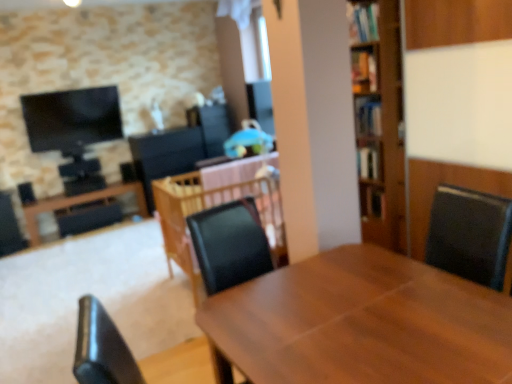
Measure the distance between wooden table at center, the second table in the back-to-front sequence, and camera.

A distance of 6.53 feet exists between wooden table at center, the second table in the back-to-front sequence, and camera.

Locate an element on the screen. wooden table at center, the second table in the back-to-front sequence is located at coordinates (208, 208).

Is the position of wooden table at center, the 2th table in the front-to-back sequence, more distant than that of wooden bookshelf at right, the 1th shelf in the bottom-to-top sequence?

No, it is not.

Between wooden table at center, the second table in the back-to-front sequence, and wooden bookshelf at right, the 1th shelf in the bottom-to-top sequence, which one has larger size?

A: wooden table at center, the second table in the back-to-front sequence, is bigger.

Does wooden table at center, the second table in the back-to-front sequence, have a lesser width compared to wooden bookshelf at right, which is the first shelf from back to front?

No.

Is wooden table at center, the second table in the back-to-front sequence, not near wooden bookshelf at right, which is the first shelf from back to front?

Yes, wooden table at center, the second table in the back-to-front sequence, and wooden bookshelf at right, which is the first shelf from back to front, are located far from each other.

Is wooden bookshelf at upper right, which is the 1th shelf in front-to-back order, positioned far away from wooden table at center, marked as the 3th table in a back-to-front arrangement?

wooden bookshelf at upper right, which is the 1th shelf in front-to-back order, is positioned a significant distance from wooden table at center, marked as the 3th table in a back-to-front arrangement.

Does wooden bookshelf at upper right, the 2th shelf from the bottom, come in front of wooden table at center, the first table viewed from the front?

No, wooden bookshelf at upper right, the 2th shelf from the bottom, is further to the viewer.

From a real-world perspective, who is located lower, wooden bookshelf at upper right, which is the 1th shelf in front-to-back order, or wooden table at center, which is counted as the first table, starting from the right?

wooden table at center, which is counted as the first table, starting from the right, from a real-world perspective.

Is wooden bookshelf at upper right, the 1th shelf positioned from the left, shorter than wooden table at center, the first table viewed from the front?

Yes.

From a real-world perspective, is wooden table at center, which is counted as the first table, starting from the right, positioned above or below wooden table at center, which is counted as the 2th table, starting from the right?

Clearly, from a real-world perspective, wooden table at center, which is counted as the first table, starting from the right, is below wooden table at center, which is counted as the 2th table, starting from the right.

Which of these two, wooden table at center, the first table viewed from the front, or wooden table at center, the second table in the back-to-front sequence, is thinner?

wooden table at center, the first table viewed from the front.

Can you confirm if wooden table at center, the first table viewed from the front, is taller than wooden table at center, which is counted as the 2th table, starting from the right?

Incorrect, the height of wooden table at center, the first table viewed from the front, is not larger of that of wooden table at center, which is counted as the 2th table, starting from the right.

Can you tell me how much wooden table at center, the third table when ordered from left to right, and wooden table at center, the 2th table in the front-to-back sequence, differ in facing direction?

The facing directions of wooden table at center, the third table when ordered from left to right, and wooden table at center, the 2th table in the front-to-back sequence, are 2.72 degrees apart.

Is wooden bookshelf at right, positioned as the second shelf in top-to-bottom order, positioned far away from wooden table at center, placed as the 2th table when sorted from left to right?

Yes.

Between wooden bookshelf at right, placed as the second shelf when sorted from front to back, and wooden table at center, the second table in the back-to-front sequence, which one has smaller width?

wooden bookshelf at right, placed as the second shelf when sorted from front to back, is thinner.

From a real-world perspective, is wooden bookshelf at right, the 1th shelf in the bottom-to-top sequence, positioned over wooden table at center, the 2th table in the front-to-back sequence, based on gravity?

Yes, from a real-world perspective, wooden bookshelf at right, the 1th shelf in the bottom-to-top sequence, is over wooden table at center, the 2th table in the front-to-back sequence

I want to click on the 1st table in front when counting from the wooden table at left, the third table positioned from the front, so click(208, 208).

From a real-world perspective, is wooden table at center, which is counted as the 2th table, starting from the right, positioned over wooden table at left, the third table positioned from the front, based on gravity?

Yes, from a real-world perspective, wooden table at center, which is counted as the 2th table, starting from the right, is above wooden table at left, the third table positioned from the front.

From the image's perspective, is wooden table at center, placed as the 2th table when sorted from left to right, located above or below wooden table at left, the third table positioned from the front?

Clearly, from the image's perspective, wooden table at center, placed as the 2th table when sorted from left to right, is below wooden table at left, the third table positioned from the front.

Between wooden table at center, the second table in the back-to-front sequence, and wooden table at left, the third table positioned from the front, which one has smaller width?

wooden table at left, the third table positioned from the front, is thinner.

Is wooden table at left, the first table viewed from the back, facing towards wooden table at center, the first table viewed from the front?

Yes, wooden table at left, the first table viewed from the back, is oriented towards wooden table at center, the first table viewed from the front.

Does point (32, 203) lie in front of point (371, 258)?

No, (32, 203) is further to viewer.

Is wooden table at left, the third table positioned from the front, next to wooden table at center, which is counted as the first table, starting from the right?

No, wooden table at left, the third table positioned from the front, is not touching wooden table at center, which is counted as the first table, starting from the right.

Between wooden table at left, the first table viewed from the back, and wooden table at center, which is counted as the first table, starting from the right, which one appears on the right side from the viewer's perspective?

From the viewer's perspective, wooden table at center, which is counted as the first table, starting from the right, appears more on the right side.

In the scene shown: Considering the sizes of objects wooden bookshelf at right, which is the 1th shelf in right-to-left order, and wooden bookshelf at upper right, which is counted as the second shelf, starting from the back, in the image provided, who is taller, wooden bookshelf at right, which is the 1th shelf in right-to-left order, or wooden bookshelf at upper right, which is counted as the second shelf, starting from the back,?

With more height is wooden bookshelf at upper right, which is counted as the second shelf, starting from the back.

Is wooden bookshelf at right, which is the first shelf from back to front, positioned with its back to wooden bookshelf at upper right, which is the 1th shelf in front-to-back order?

No, wooden bookshelf at right, which is the first shelf from back to front, is not facing away from wooden bookshelf at upper right, which is the 1th shelf in front-to-back order.

Is wooden bookshelf at right, which is the first shelf from back to front, not near wooden bookshelf at upper right, which is counted as the second shelf, starting from the back?

Yes, wooden bookshelf at right, which is the first shelf from back to front, is far from wooden bookshelf at upper right, which is counted as the second shelf, starting from the back.

Does wooden bookshelf at right, which ranks as the second shelf in left-to-right order, have a greater width compared to wooden bookshelf at upper right, the 2th shelf from the bottom?

No.

From the image's perspective, count 2nd tables downward from the wooden bookshelf at right, the 1th shelf in the bottom-to-top sequence, and point to it. Please provide its 2D coordinates.

[(208, 208)]

Find the location of a particular element. shelf that is the 1st object to the right of the wooden table at center, the third table when ordered from left to right, starting at the anchor is located at coordinates (362, 22).

Based on their spatial positions, is wooden bookshelf at right, which ranks as the second shelf in left-to-right order, or wooden table at center, the 2th table in the front-to-back sequence, closer to wooden bookshelf at upper right, which is the 1th shelf in front-to-back order?

wooden bookshelf at right, which ranks as the second shelf in left-to-right order.

From the image, which object appears to be farther from wooden table at left, which ranks as the 1th table in left-to-right order, wooden bookshelf at upper right, marked as the second shelf in a right-to-left arrangement, or wooden bookshelf at right, positioned as the second shelf in top-to-bottom order?

wooden bookshelf at upper right, marked as the second shelf in a right-to-left arrangement, is positioned further to the anchor wooden table at left, which ranks as the 1th table in left-to-right order.

When comparing their distances from wooden bookshelf at upper right, the 1th shelf positioned from the left, does wooden bookshelf at right, which is the first shelf from back to front, or wooden table at left, which ranks as the third table in right-to-left order, seem closer?

wooden bookshelf at right, which is the first shelf from back to front, is closer to wooden bookshelf at upper right, the 1th shelf positioned from the left.

Based on their spatial positions, is wooden table at center, which is counted as the first table, starting from the right, or wooden bookshelf at upper right, marked as the second shelf in a right-to-left arrangement, further from wooden table at left, which ranks as the 1th table in left-to-right order?

Based on the image, wooden table at center, which is counted as the first table, starting from the right, appears to be further to wooden table at left, which ranks as the 1th table in left-to-right order.

Looking at the image, which one is located further to wooden table at center, marked as the 3th table in a back-to-front arrangement, wooden bookshelf at upper right, which is the 1th shelf in front-to-back order, or wooden table at left, which ranks as the 1th table in left-to-right order?

Among the two, wooden table at left, which ranks as the 1th table in left-to-right order, is located further to wooden table at center, marked as the 3th table in a back-to-front arrangement.

Which object lies nearer to the anchor point wooden table at center, which is counted as the first table, starting from the right, wooden bookshelf at upper right, the 2th shelf from the bottom, or wooden bookshelf at right, positioned as the second shelf in top-to-bottom order?

Among the two, wooden bookshelf at right, positioned as the second shelf in top-to-bottom order, is located nearer to wooden table at center, which is counted as the first table, starting from the right.

Looking at the image, which one is located closer to wooden bookshelf at right, which is the first shelf from back to front, wooden table at left, the first table viewed from the back, or wooden table at center, placed as the 2th table when sorted from left to right?

wooden table at center, placed as the 2th table when sorted from left to right.

Looking at the image, which one is located further to wooden bookshelf at right, placed as the second shelf when sorted from front to back, wooden table at center, which is counted as the first table, starting from the right, or wooden table at left, which ranks as the third table in right-to-left order?

wooden table at left, which ranks as the third table in right-to-left order, is positioned further to the anchor wooden bookshelf at right, placed as the second shelf when sorted from front to back.

Locate an element on the screen. The image size is (512, 384). table positioned between wooden table at center, marked as the 3th table in a back-to-front arrangement, and wooden bookshelf at upper right, which is counted as the second shelf, starting from the back, from near to far is located at coordinates (208, 208).

The width and height of the screenshot is (512, 384). I want to click on shelf between wooden table at center, the third table when ordered from left to right, and wooden bookshelf at right, placed as the second shelf when sorted from front to back, from front to back, so click(x=362, y=22).

Locate an element on the screen. The height and width of the screenshot is (384, 512). shelf between wooden table at left, the third table positioned from the front, and wooden bookshelf at right, placed as the second shelf when sorted from front to back, from left to right is located at coordinates (362, 22).

Where is `table between wooden table at center, marked as the 3th table in a back-to-front arrangement, and wooden table at left, the first table viewed from the back, from front to back`? table between wooden table at center, marked as the 3th table in a back-to-front arrangement, and wooden table at left, the first table viewed from the back, from front to back is located at coordinates (208, 208).